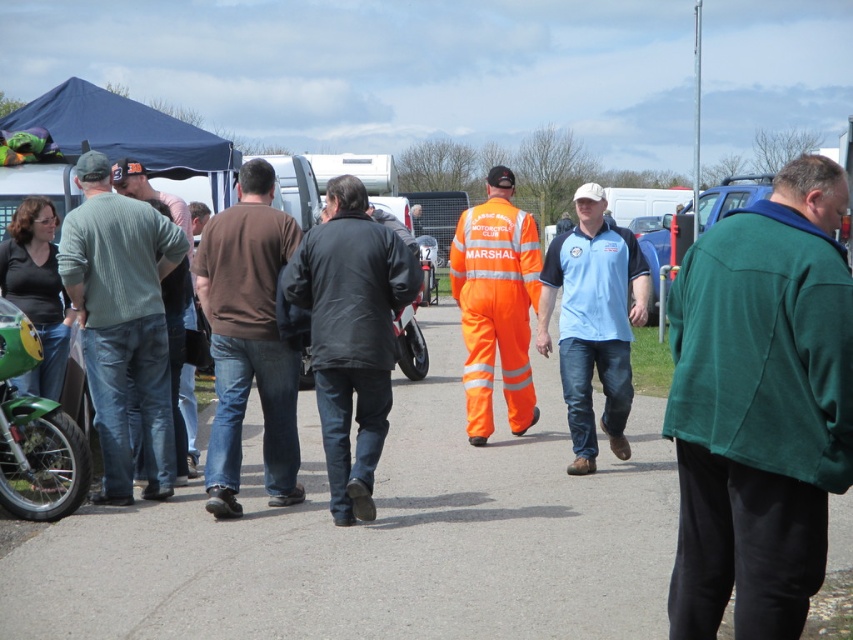
Question: Which object is positioned closest to the black leather jacket at center?

Choices:
 (A) light blue fabric shirt at center
 (B) brown cotton sweater at center

Answer: (B)

Question: Is knitted green sweater at left in front of blue fabric canopy at upper left?

Choices:
 (A) no
 (B) yes

Answer: (B)

Question: Can you confirm if knitted green sweater at left is positioned above blue fabric canopy at upper left?

Choices:
 (A) yes
 (B) no

Answer: (B)

Question: Does brown cotton sweater at center have a lesser width compared to orange reflective jumpsuit at center?

Choices:
 (A) no
 (B) yes

Answer: (A)

Question: Which point appears farthest from the camera in this image?

Choices:
 (A) (469, 440)
 (B) (590, 410)

Answer: (A)

Question: Which point is farther to the camera?

Choices:
 (A) (721, 541)
 (B) (12, 321)

Answer: (B)